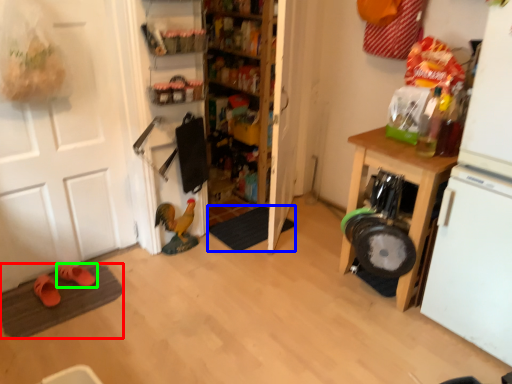
Question: Estimate the real-world distances between objects in this image. Which object is closer to doormat (highlighted by a red box), doormat (highlighted by a blue box) or footwear (highlighted by a green box)?

Choices:
 (A) doormat
 (B) footwear

Answer: (B)